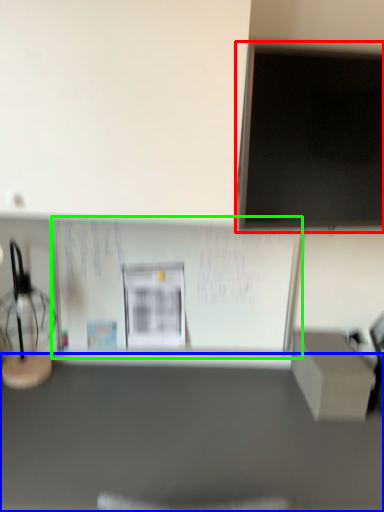
Question: Which object is positioned farthest from computer monitor (highlighted by a red box)? Select from furniture (highlighted by a blue box) and bulletin board (highlighted by a green box).

Choices:
 (A) furniture
 (B) bulletin board

Answer: (A)